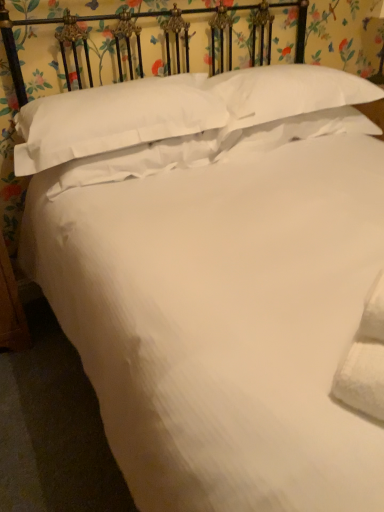
Question: From a real-world perspective, is white soft pillow at upper center, the 3th pillow in the left-to-right sequence, located higher than white cotton pillow at upper center, which is counted as the 4th pillow, starting from the right?

Choices:
 (A) yes
 (B) no

Answer: (B)

Question: Considering the relative sizes of white soft pillow at upper center, which is the second pillow in right-to-left order, and white cotton pillow at upper center, which is counted as the 4th pillow, starting from the right, in the image provided, is white soft pillow at upper center, which is the second pillow in right-to-left order, bigger than white cotton pillow at upper center, which is counted as the 4th pillow, starting from the right,?

Choices:
 (A) no
 (B) yes

Answer: (A)

Question: Is white soft pillow at upper center, which is the second pillow in right-to-left order, thinner than white cotton pillow at upper center, acting as the first pillow starting from the left?

Choices:
 (A) no
 (B) yes

Answer: (A)

Question: From the image's perspective, is white soft pillow at upper center, the 3th pillow in the left-to-right sequence, beneath white cotton pillow at upper center, which is counted as the 4th pillow, starting from the right?

Choices:
 (A) no
 (B) yes

Answer: (A)

Question: From a real-world perspective, is white soft pillow at upper center, which is the second pillow in right-to-left order, positioned under white cotton pillow at upper center, which is counted as the 4th pillow, starting from the right, based on gravity?

Choices:
 (A) no
 (B) yes

Answer: (B)

Question: Would you say white soft pillow at upper center, which is the second pillow in right-to-left order, is a long distance from white cotton pillow at upper center, which is counted as the 4th pillow, starting from the right?

Choices:
 (A) no
 (B) yes

Answer: (A)

Question: Can you confirm if white soft pillow at center, which is the 3th pillow in right-to-left order, is taller than white soft pillow at upper center, the 3th pillow in the left-to-right sequence?

Choices:
 (A) yes
 (B) no

Answer: (B)

Question: From the image's perspective, does white soft pillow at center, which is the 3th pillow in right-to-left order, appear lower than white soft pillow at upper center, the 3th pillow in the left-to-right sequence?

Choices:
 (A) no
 (B) yes

Answer: (B)

Question: From a real-world perspective, is white soft pillow at center, which is the 3th pillow in right-to-left order, located higher than white soft pillow at upper center, which is the second pillow in right-to-left order?

Choices:
 (A) yes
 (B) no

Answer: (A)

Question: From a real-world perspective, is white soft pillow at center, which ranks as the second pillow in left-to-right order, located beneath white soft pillow at upper center, which is the second pillow in right-to-left order?

Choices:
 (A) yes
 (B) no

Answer: (B)

Question: Is white soft pillow at center, which is the 3th pillow in right-to-left order, facing towards white soft pillow at upper center, the 3th pillow in the left-to-right sequence?

Choices:
 (A) no
 (B) yes

Answer: (A)

Question: Does white soft pillow at center, which ranks as the second pillow in left-to-right order, have a larger size compared to white soft pillow at upper center, which is the second pillow in right-to-left order?

Choices:
 (A) yes
 (B) no

Answer: (B)

Question: Is white soft pillow at upper center, the 3th pillow in the left-to-right sequence, at the right side of white soft pillow at upper center, positioned as the 1th pillow in right-to-left order?

Choices:
 (A) no
 (B) yes

Answer: (A)